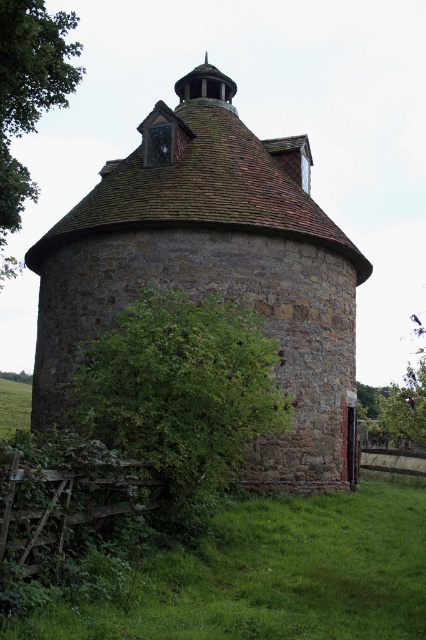
Question: Which point is closer to the camera?

Choices:
 (A) green leafy tree at left
 (B) brown stone silo at center
 (C) green leafy bush at lower left

Answer: (C)

Question: Which object appears farthest from the camera in this image?

Choices:
 (A) green leafy tree at left
 (B) brown stone silo at center
 (C) green leafy bush at lower left

Answer: (B)

Question: Where is brown stone silo at center located in relation to green leafy bush at lower left in the image?

Choices:
 (A) above
 (B) below

Answer: (A)

Question: Does brown stone silo at center have a larger size compared to green leafy tree at left?

Choices:
 (A) no
 (B) yes

Answer: (A)

Question: Which of the following is the farthest from the observer?

Choices:
 (A) green leafy tree at left
 (B) brown stone silo at center

Answer: (B)

Question: Does green leafy bush at lower left appear on the right side of green leafy tree at left?

Choices:
 (A) yes
 (B) no

Answer: (A)